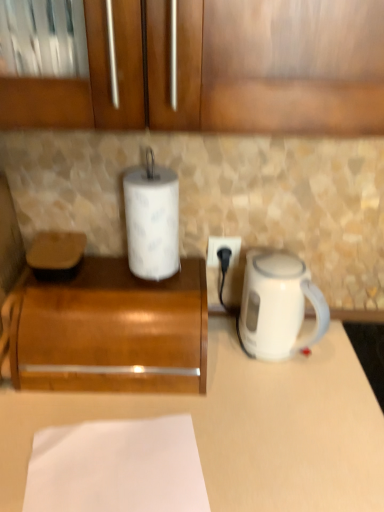
The image size is (384, 512). Identify the location of vacant area that lies to the right of white paper at lower center. (254, 443).